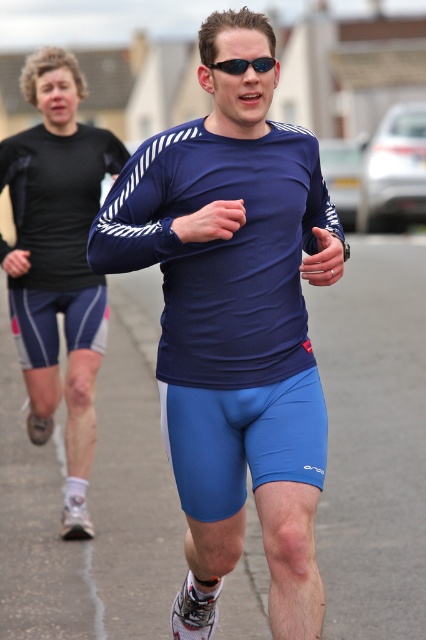
Can you confirm if matte blue running suit at center is positioned to the right of matte black shorts at left?

Indeed, matte blue running suit at center is positioned on the right side of matte black shorts at left.

Is matte blue running suit at center bigger than matte black shorts at left?

Yes, matte blue running suit at center is bigger than matte black shorts at left.

This screenshot has width=426, height=640. What are the coordinates of `matte blue running suit at center` in the screenshot? It's located at (235, 323).

At what (x,y) coordinates should I click in order to perform the action: click on matte blue running suit at center. Please return your answer as a coordinate pair (x, y). Looking at the image, I should click on (235, 323).

Does matte blue running suit at center appear over sunglasses at center?

No, matte blue running suit at center is not above sunglasses at center.

Is matte blue running suit at center to the left of sunglasses at center from the viewer's perspective?

Indeed, matte blue running suit at center is positioned on the left side of sunglasses at center.

Is point (161, 392) farther from camera compared to point (255, 65)?

Yes, point (161, 392) is behind point (255, 65).

This screenshot has height=640, width=426. What are the coordinates of `matte blue running suit at center` in the screenshot? It's located at (235, 323).

Who is lower down, matte black shorts at left or sunglasses at center?

matte black shorts at left is lower down.

Is matte black shorts at left further to camera compared to sunglasses at center?

Yes, matte black shorts at left is behind sunglasses at center.

Who is more distant from viewer, (88,284) or (256,67)?

The point (88,284) is behind.

Image resolution: width=426 pixels, height=640 pixels. I want to click on matte black shorts at left, so click(x=57, y=260).